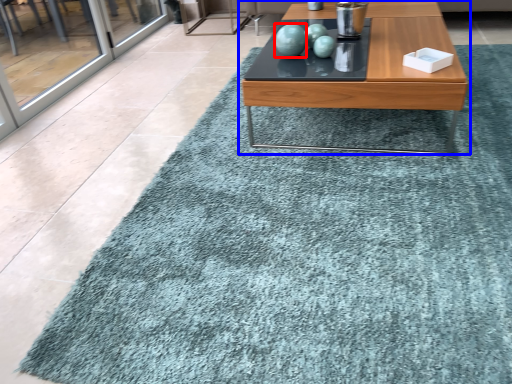
Question: Which object appears closest to the camera in this image, turquoise (highlighted by a red box) or coffee table (highlighted by a blue box)?

Choices:
 (A) turquoise
 (B) coffee table

Answer: (B)